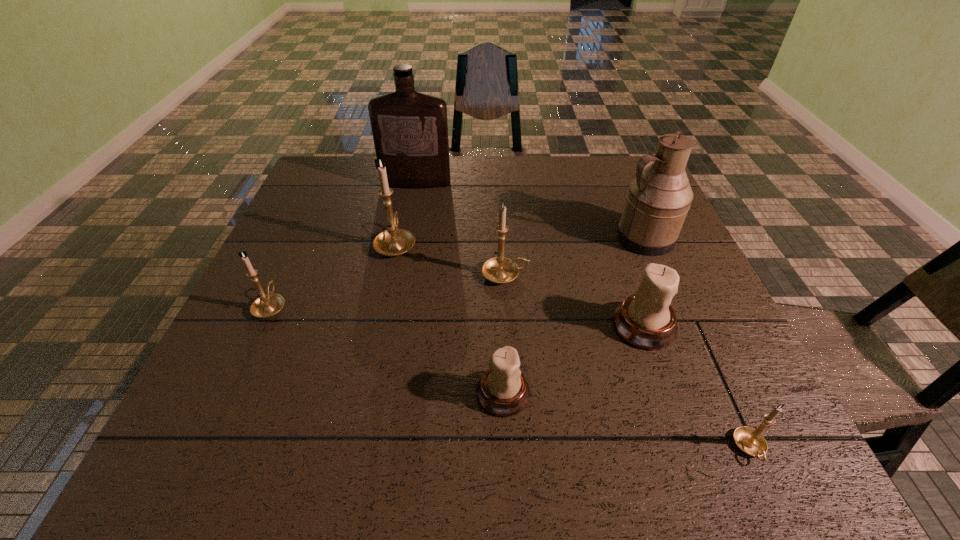
Find the location of a particular element. The image size is (960, 540). vacant space at the far edge of the desktop is located at coordinates (510, 169).

Identify the location of blank space at the near edge of the desktop. (293, 440).

This screenshot has width=960, height=540. In order to click on vacant space at the left edge of the desktop in this screenshot , I will do `click(282, 245)`.

In the image, there is a desktop. At what (x,y) coordinates should I click in order to perform the action: click on blank space at the right edge. Please return your answer as a coordinate pair (x, y). This screenshot has height=540, width=960. Looking at the image, I should click on (613, 214).

Image resolution: width=960 pixels, height=540 pixels. Find the location of `vacant region at the far left corner`. vacant region at the far left corner is located at coordinates (359, 177).

In order to click on free region at the near right corner of the desktop in this screenshot , I will do pos(781,472).

In order to click on free area in between the leftmost candle holder and the right white candle holder in this screenshot , I will do `click(457, 316)`.

Image resolution: width=960 pixels, height=540 pixels. Identify the location of free point between the nearest candle holder and the second biggest gold candle holder. (628, 361).

Find the location of a particular element. The width and height of the screenshot is (960, 540). unoccupied area between the liquor and the bigger white candle holder is located at coordinates (530, 254).

Locate an element on the screen. This screenshot has width=960, height=540. vacant area that lies between the pitcher and the leftmost object is located at coordinates (458, 272).